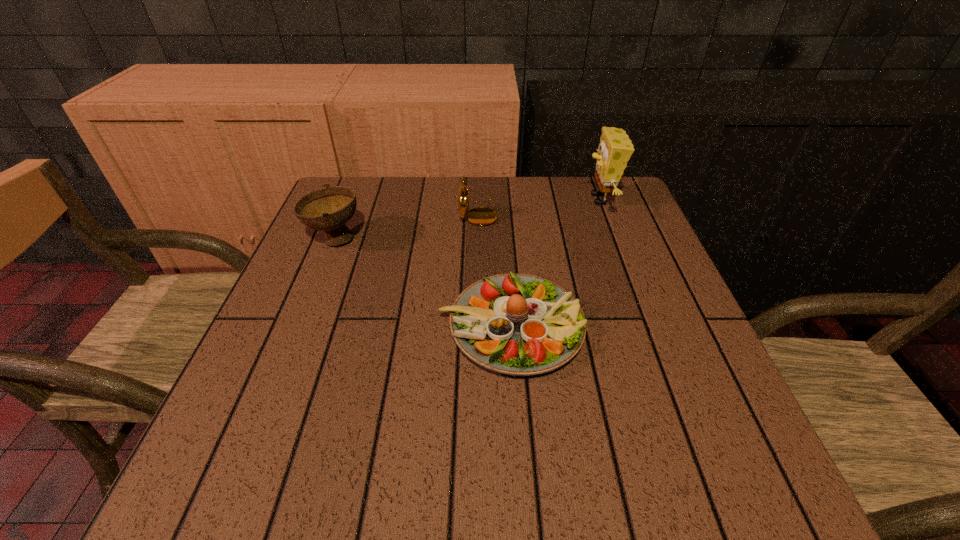
Locate an element on the screen. sponge is located at coordinates (615, 149).

Locate an element on the screen. The image size is (960, 540). the rightmost object is located at coordinates point(615,149).

This screenshot has width=960, height=540. Identify the location of soup bowl. (328, 209).

Where is `pocket watch`? Image resolution: width=960 pixels, height=540 pixels. pocket watch is located at coordinates (481, 216).

This screenshot has height=540, width=960. What are the coordinates of `the shortest object` in the screenshot? It's located at (515, 324).

You are a GUI agent. You are given a task and a screenshot of the screen. Output one action in this format:
    pyautogui.click(x=<x>, y=<y>)
    Task: Click on the salad plate
    The height and width of the screenshot is (540, 960).
    Given the screenshot: What is the action you would take?
    pyautogui.click(x=515, y=324)

This screenshot has height=540, width=960. Find the location of `vacant area situated 0.320m on the face of the rightmost object`. vacant area situated 0.320m on the face of the rightmost object is located at coordinates (464, 199).

Identify the location of vacant space located on the face of the rightmost object. This screenshot has width=960, height=540. (460, 199).

The width and height of the screenshot is (960, 540). I want to click on vacant space located on the face of the rightmost object, so click(x=542, y=199).

Where is `vacant space located 0.140m on the back of the leftmost object`? Image resolution: width=960 pixels, height=540 pixels. vacant space located 0.140m on the back of the leftmost object is located at coordinates (354, 192).